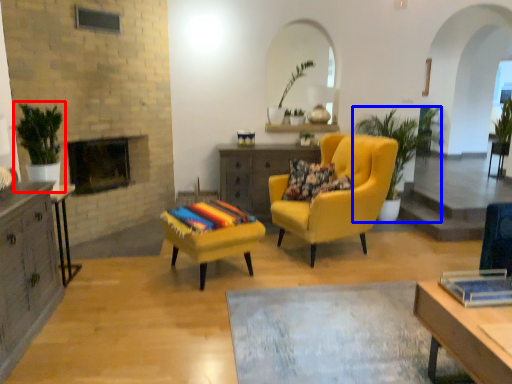
Question: Which object is further to the camera taking this photo, houseplant (highlighted by a red box) or houseplant (highlighted by a blue box)?

Choices:
 (A) houseplant
 (B) houseplant

Answer: (B)